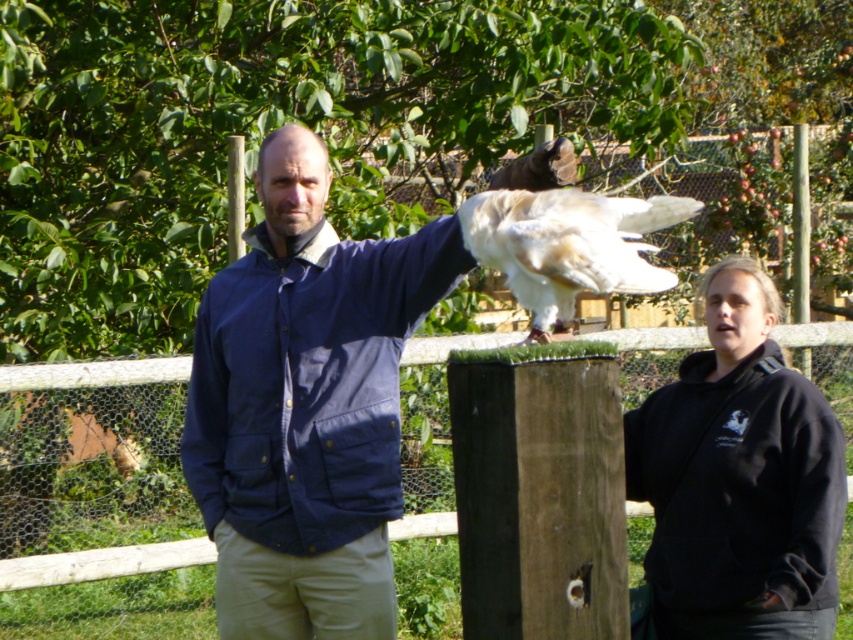
Is point (236, 564) positioned before point (572, 257)?

No, it is behind (572, 257).

Does blue cotton jacket at center appear under white feathered bird at center?

Yes.

Is point (325, 497) positioned after point (666, 284)?

Yes, it is.

Identify the location of blue cotton jacket at center. The width and height of the screenshot is (853, 640). (306, 404).

Is point (415, 468) positioned after point (640, 280)?

Yes.

Where is `wooden post at center`? wooden post at center is located at coordinates (96, 508).

What are the coordinates of `blue cotton jacket at center` in the screenshot? It's located at (306, 404).

Can you confirm if blue cotton jacket at center is shorter than wooden post at center?

Incorrect, blue cotton jacket at center's height does not fall short of wooden post at center's.

Locate an element on the screen. The height and width of the screenshot is (640, 853). blue cotton jacket at center is located at coordinates (306, 404).